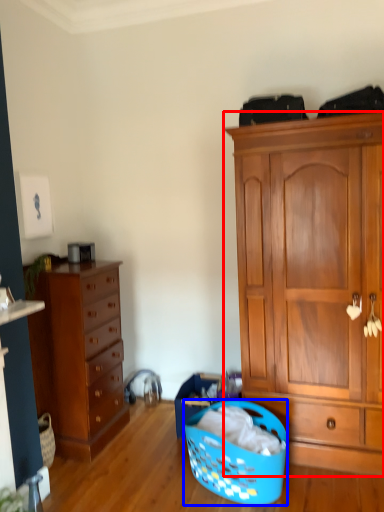
Question: Which object appears closest to the camera in this image, cabinetry (highlighted by a red box) or picnic basket (highlighted by a blue box)?

Choices:
 (A) cabinetry
 (B) picnic basket

Answer: (B)